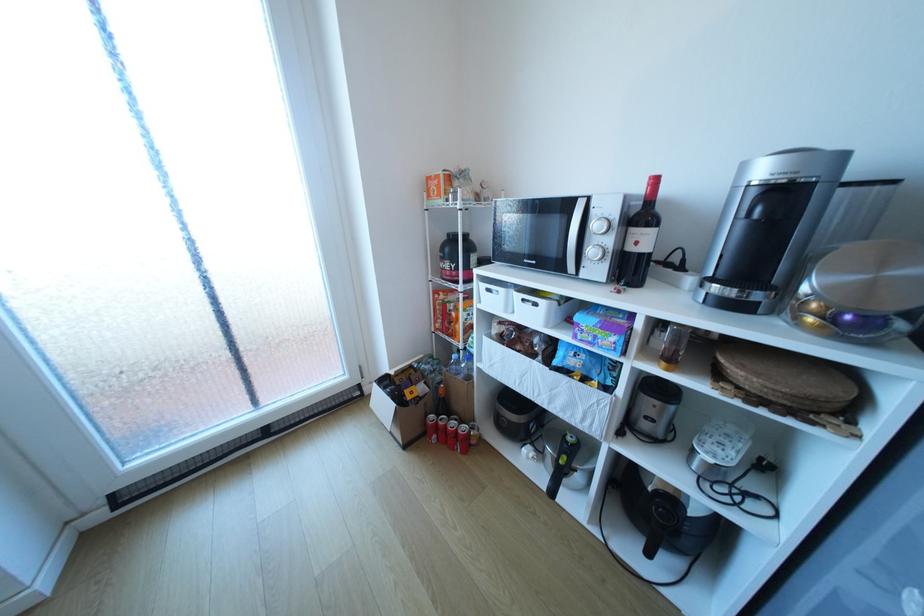
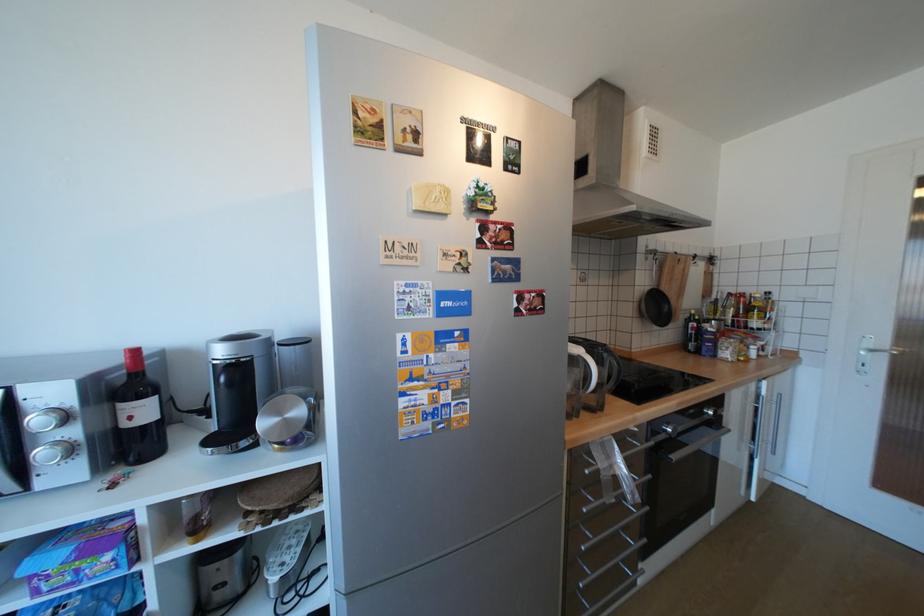
Where in the second image is the point corresponding to pixel 820 320 from the first image?

(286, 446)